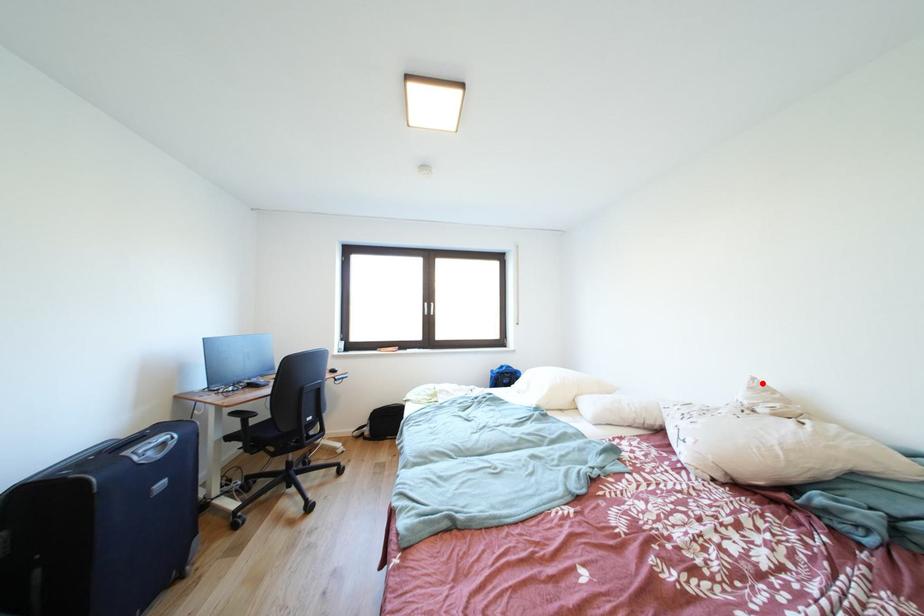
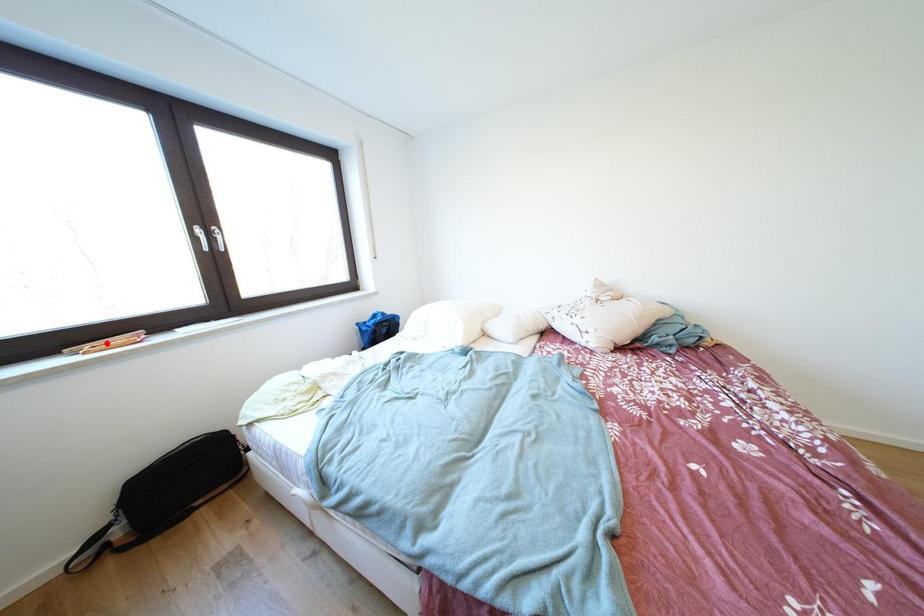
I am providing you with two images of the same scene from different viewpoints. A red point is marked on the first image and another point is marked on the second image. Does the point marked in image1 correspond to the same location as the one in image2?

No